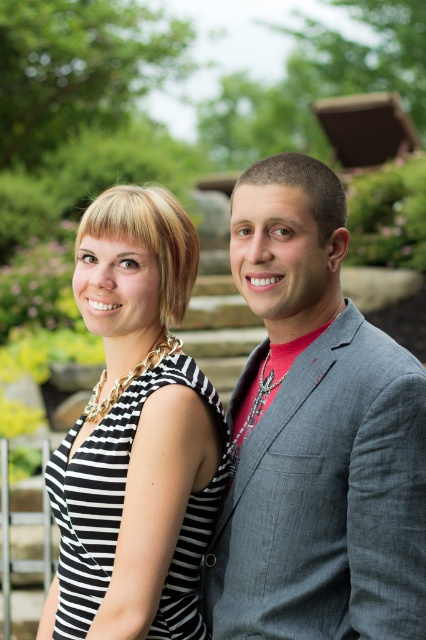
Question: Does gray textured blazer at right have a larger size compared to black striped fabric dress at center?

Choices:
 (A) no
 (B) yes

Answer: (B)

Question: Can you confirm if gray textured blazer at right is smaller than black striped fabric dress at center?

Choices:
 (A) no
 (B) yes

Answer: (A)

Question: Which object appears farthest from the camera in this image?

Choices:
 (A) black striped fabric dress at center
 (B) gray textured blazer at right

Answer: (A)

Question: Which object is closer to the camera taking this photo?

Choices:
 (A) gray textured blazer at right
 (B) black striped fabric dress at center

Answer: (A)

Question: Where is gray textured blazer at right located in relation to black striped fabric dress at center in the image?

Choices:
 (A) below
 (B) above

Answer: (B)